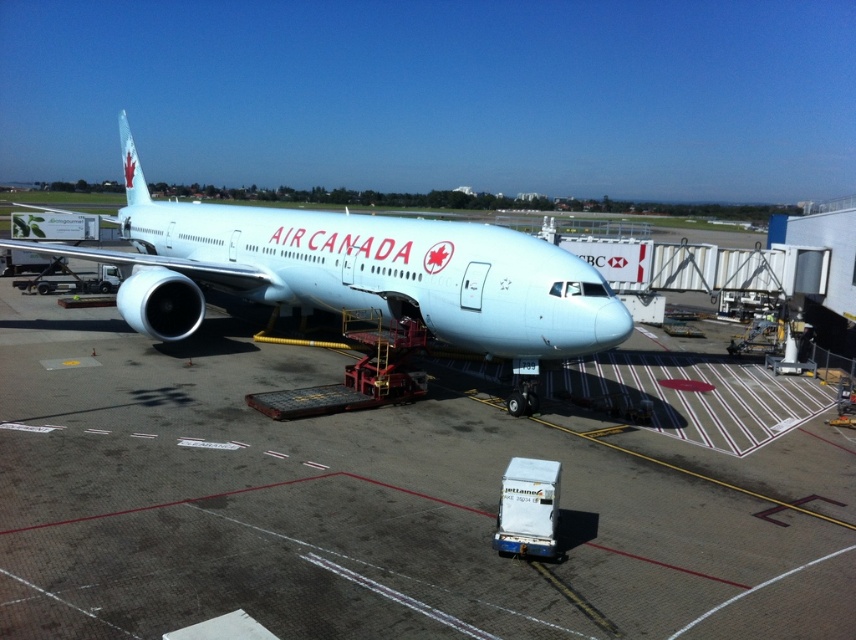
Does white glossy tarmac at center have a greater height compared to light blue metallic airplane at center?

No.

Between point (849, 625) and point (462, 308), which one is positioned in front?

Point (849, 625) is more forward.

What are the coordinates of `white glossy tarmac at center` in the screenshot? It's located at (376, 506).